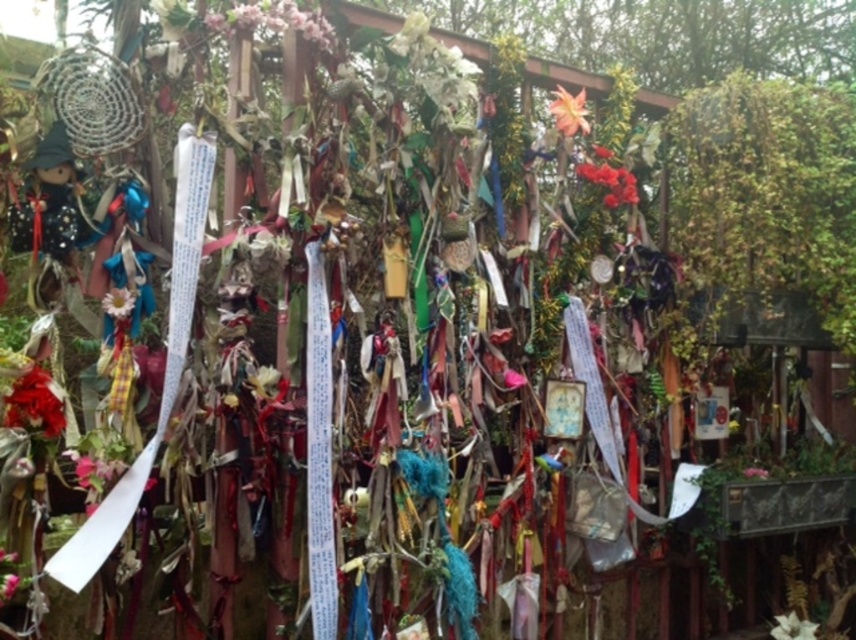
You are an artist planning to paint this scene. You want to ensure the orange matte flower at upper center and the white matte flower at center are proportionally accurate. Which flower should you paint as taller in your artwork?

The orange matte flower at upper center should be painted as taller than the white matte flower at center because the description states that it is taller.

You are standing in front of the wooden structure with decorations. You want to take a photo of the orange matte flower at upper center using a camera that has a minimum focusing distance of 2 meters. Can you take the photo without moving the camera?

The orange matte flower at upper center and camera are 2.35 meters apart from each other. Since the minimum focusing distance is 2 meters, the camera can focus on the orange matte flower at upper center as the distance is sufficient.

You are standing in front of the wooden structure and see the white paper flower at center and the pink fabric flower at center. Which flower is positioned to the left?

The white paper flower at center is positioned to the left of the pink fabric flower at center.